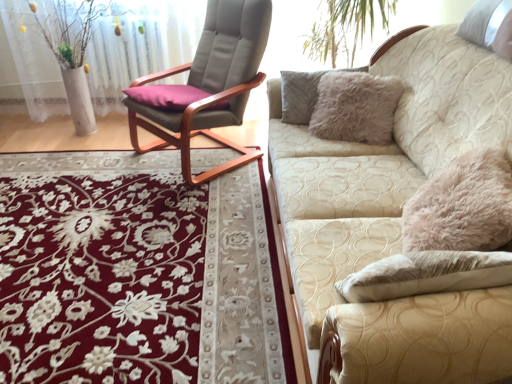
Question: Can you confirm if beige textured couch at right is smaller than floral carpet at center?

Choices:
 (A) no
 (B) yes

Answer: (A)

Question: Is beige textured couch at right turned away from floral carpet at center?

Choices:
 (A) no
 (B) yes

Answer: (A)

Question: Does beige textured couch at right have a larger size compared to floral carpet at center?

Choices:
 (A) no
 (B) yes

Answer: (B)

Question: From a real-world perspective, is beige textured couch at right on floral carpet at center?

Choices:
 (A) yes
 (B) no

Answer: (A)

Question: Is beige textured couch at right oriented towards floral carpet at center?

Choices:
 (A) no
 (B) yes

Answer: (B)

Question: From the image's perspective, is beige textured couch at right on floral carpet at center?

Choices:
 (A) no
 (B) yes

Answer: (B)

Question: From a real-world perspective, does white matte vase at left sit lower than beige textured couch at right?

Choices:
 (A) no
 (B) yes

Answer: (A)

Question: Can you confirm if white matte vase at left is thinner than beige textured couch at right?

Choices:
 (A) yes
 (B) no

Answer: (A)

Question: Is white matte vase at left positioned far away from beige textured couch at right?

Choices:
 (A) yes
 (B) no

Answer: (A)

Question: Can you confirm if white matte vase at left is smaller than beige textured couch at right?

Choices:
 (A) yes
 (B) no

Answer: (A)

Question: From the image's perspective, would you say white matte vase at left is positioned over beige textured couch at right?

Choices:
 (A) yes
 (B) no

Answer: (A)

Question: Could you tell me if white matte vase at left is turned towards beige textured couch at right?

Choices:
 (A) no
 (B) yes

Answer: (A)

Question: Considering the relative sizes of white matte vase at left and matte gray cushioned chair at center in the image provided, is white matte vase at left smaller than matte gray cushioned chair at center?

Choices:
 (A) yes
 (B) no

Answer: (A)